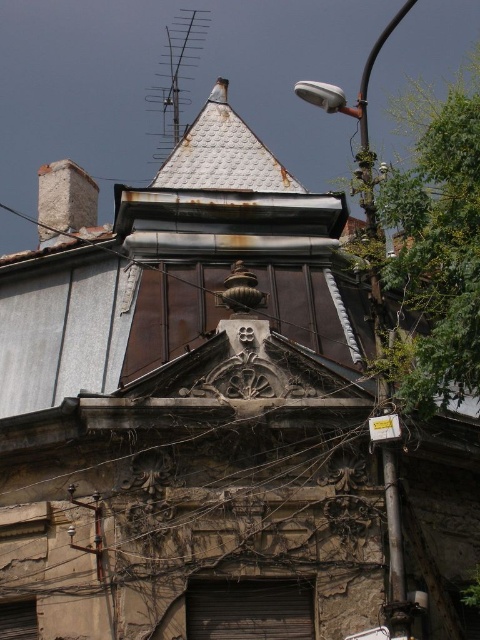
Question: Can you confirm if metallic streetlight at upper right is positioned to the right of rusty metal antenna at upper center?

Choices:
 (A) yes
 (B) no

Answer: (A)

Question: Is metallic streetlight at upper right wider than rusty metal roof at upper center?

Choices:
 (A) no
 (B) yes

Answer: (B)

Question: Which point is closer to the camera?

Choices:
 (A) rusty brick chimney at upper left
 (B) metallic streetlight at upper right
 (C) green leafy tree at upper right
 (D) rusty metal roof at upper center

Answer: (C)

Question: Which of the following is the farthest from the observer?

Choices:
 (A) (56, 221)
 (B) (428, 292)
 (C) (400, 621)
 (D) (205, 172)

Answer: (A)

Question: Which point appears closest to the camera in this image?

Choices:
 (A) (156, 152)
 (B) (93, 196)

Answer: (B)

Question: Is metallic streetlight at upper right behind rusty brick chimney at upper left?

Choices:
 (A) no
 (B) yes

Answer: (A)